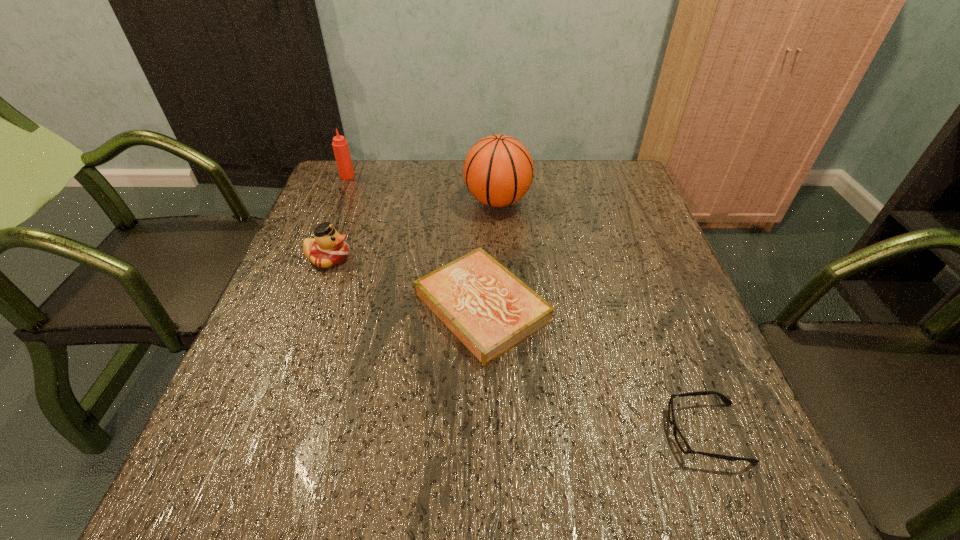
The width and height of the screenshot is (960, 540). I want to click on the tallest object, so click(x=498, y=171).

This screenshot has width=960, height=540. In order to click on basketball in this screenshot , I will do `click(498, 171)`.

In order to click on the farthest object in this screenshot , I will do `click(340, 146)`.

Image resolution: width=960 pixels, height=540 pixels. Identify the location of the second tallest object. (340, 146).

At what (x,y) coordinates should I click in order to perform the action: click on duck. Please return your answer as a coordinate pair (x, y). The image size is (960, 540). Looking at the image, I should click on (328, 248).

The height and width of the screenshot is (540, 960). Find the location of `hardback book`. hardback book is located at coordinates (490, 310).

Identify the location of the nearest object. (680, 440).

Locate an element on the screen. the rightmost object is located at coordinates (680, 440).

Locate an element on the screen. free space located on the front of the fourth nearest object is located at coordinates (500, 251).

Where is `blank space located on the right of the fourth shortest object`? The width and height of the screenshot is (960, 540). blank space located on the right of the fourth shortest object is located at coordinates (482, 176).